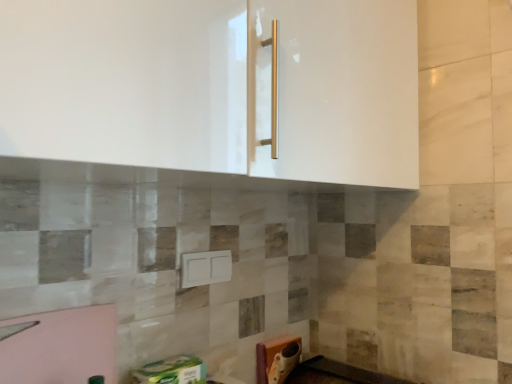
Question: Should I look upward or downward to see black glossy countertop at lower center?

Choices:
 (A) up
 (B) down

Answer: (B)